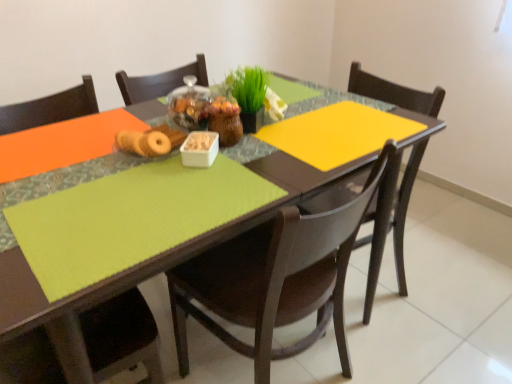
Image resolution: width=512 pixels, height=384 pixels. I want to click on free space in front of green matte grass at center, so click(269, 155).